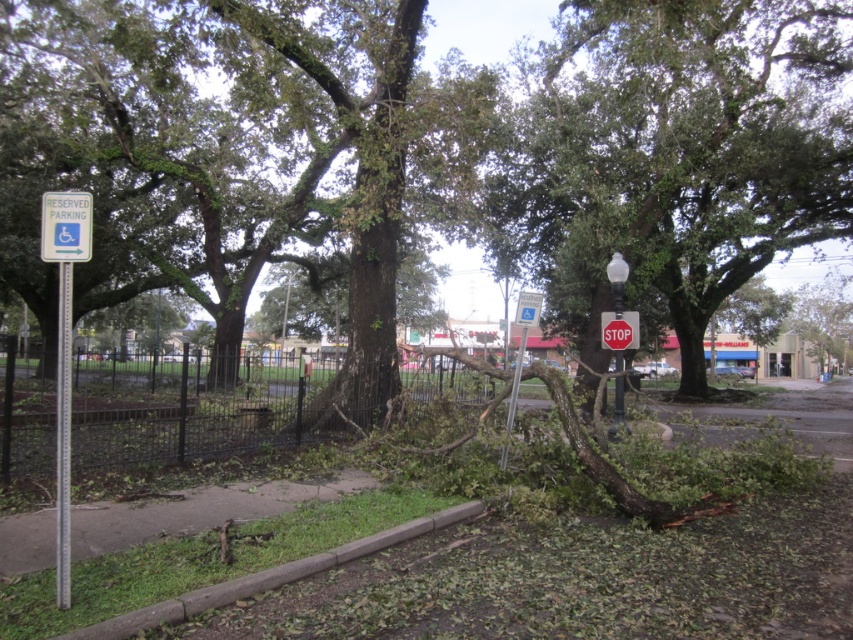
You are a pedestrian trying to cross the street and notice the green plastic reserved parking sign at upper left and the red matte stop sign at center. Which sign is positioned higher relative to the other?

The green plastic reserved parking sign at upper left is above the red matte stop sign at center.